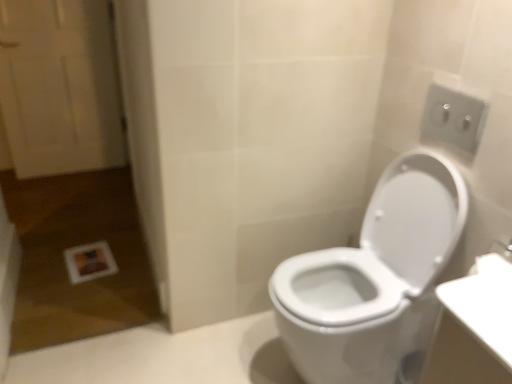
Question: Considering the positions of point (387, 177) and point (472, 129), is point (387, 177) closer or farther from the camera than point (472, 129)?

Choices:
 (A) farther
 (B) closer

Answer: (A)

Question: Would you say white glossy toilet at right is to the left or to the right of white plastic outlet at upper right in the picture?

Choices:
 (A) right
 (B) left

Answer: (B)

Question: Estimate the real-world distances between objects in this image. Which object is farther from the white plastic outlet at upper right?

Choices:
 (A) white glossy toilet at right
 (B) white wooden door at left

Answer: (B)

Question: Based on their relative distances, which object is farther from the white plastic outlet at upper right?

Choices:
 (A) white glossy toilet at right
 (B) white wooden door at left

Answer: (B)